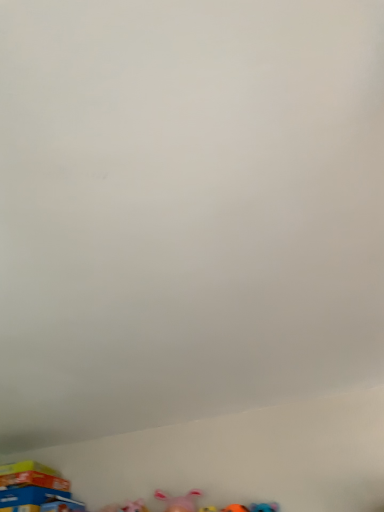
Question: Is blue cardboard box at lower left, which ranks as the 2th toy in right-to-left order, bigger than pink fabric toy at lower center, the 1th toy from the front?

Choices:
 (A) yes
 (B) no

Answer: (A)

Question: Is blue cardboard box at lower left, which appears as the 1th toy when viewed from the back, shorter than pink fabric toy at lower center, the second toy viewed from the left?

Choices:
 (A) no
 (B) yes

Answer: (A)

Question: Is blue cardboard box at lower left, which appears as the 1th toy when viewed from the back, smaller than pink fabric toy at lower center, the 1th toy from the front?

Choices:
 (A) yes
 (B) no

Answer: (B)

Question: From the image's perspective, is blue cardboard box at lower left, which ranks as the 2th toy in right-to-left order, under pink fabric toy at lower center, the 1th toy in the right-to-left sequence?

Choices:
 (A) no
 (B) yes

Answer: (B)

Question: From the image's perspective, is blue cardboard box at lower left, positioned as the second toy in front-to-back order, above pink fabric toy at lower center, the second toy viewed from the left?

Choices:
 (A) yes
 (B) no

Answer: (B)

Question: Considering the relative positions of blue cardboard box at lower left, which appears as the 1th toy when viewed from the back, and pink fabric toy at lower center, the 1th toy from the front, in the image provided, is blue cardboard box at lower left, which appears as the 1th toy when viewed from the back, in front of pink fabric toy at lower center, the 1th toy from the front,?

Choices:
 (A) no
 (B) yes

Answer: (A)

Question: From a real-world perspective, is pink fabric toy at lower center, the second toy viewed from the left, physically below blue cardboard box at lower left, positioned as the second toy in front-to-back order?

Choices:
 (A) yes
 (B) no

Answer: (A)

Question: Is the position of pink fabric toy at lower center, the 1th toy in the right-to-left sequence, more distant than that of blue cardboard box at lower left, which appears as the 1th toy when viewed from the back?

Choices:
 (A) no
 (B) yes

Answer: (A)

Question: Does pink fabric toy at lower center, the 1th toy in the right-to-left sequence, have a lesser height compared to blue cardboard box at lower left, which appears as the 1th toy when viewed from the back?

Choices:
 (A) no
 (B) yes

Answer: (B)

Question: From the image's perspective, does pink fabric toy at lower center, the 1th toy in the right-to-left sequence, appear lower than blue cardboard box at lower left, which ranks as the 2th toy in right-to-left order?

Choices:
 (A) yes
 (B) no

Answer: (B)

Question: Is pink fabric toy at lower center, the second toy viewed from the left, oriented towards blue cardboard box at lower left, the 1th toy in the left-to-right sequence?

Choices:
 (A) yes
 (B) no

Answer: (B)

Question: Is blue cardboard box at lower left, the 1th toy in the left-to-right sequence, inside pink fabric toy at lower center, the 1th toy in the right-to-left sequence?

Choices:
 (A) no
 (B) yes

Answer: (A)

Question: From the image's perspective, is blue cardboard box at lower left, which appears as the 1th toy when viewed from the back, positioned above or below pink fabric toy at lower center, the 1th toy in the right-to-left sequence?

Choices:
 (A) below
 (B) above

Answer: (A)